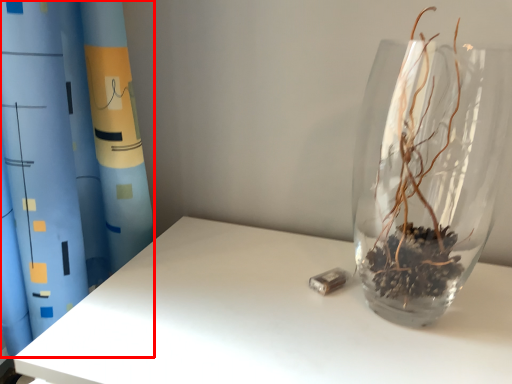
Question: Where is curtain (annotated by the red box) located in relation to vase in the image?

Choices:
 (A) right
 (B) left

Answer: (B)